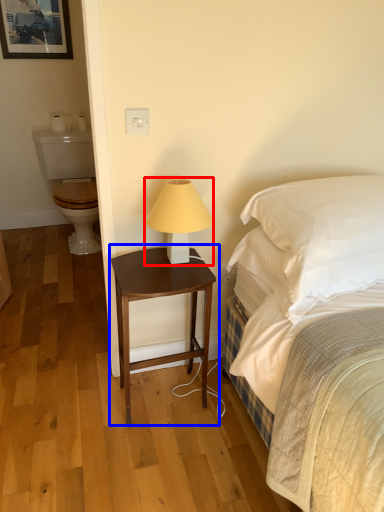
Question: Which of the following is the closest to the observer, table lamp (highlighted by a red box) or nightstand (highlighted by a blue box)?

Choices:
 (A) table lamp
 (B) nightstand

Answer: (A)